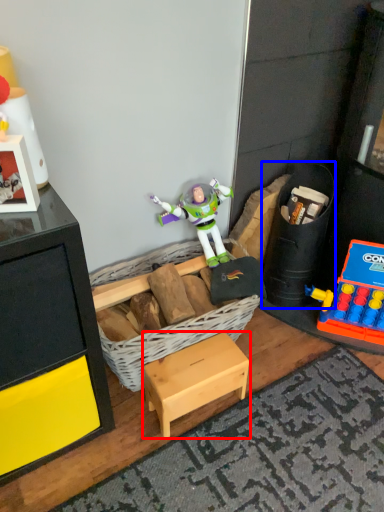
Question: Which of the following is the closest to the observer, furniture (highlighted by a red box) or toy (highlighted by a blue box)?

Choices:
 (A) furniture
 (B) toy

Answer: (A)